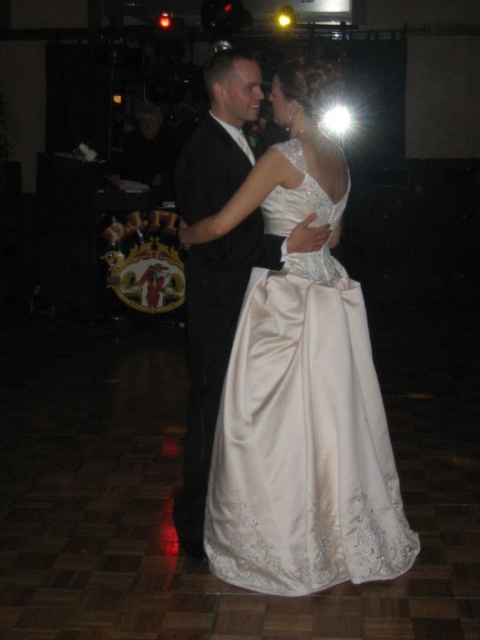
Question: Considering the relative positions of satin/embroidered dress at center and black satin suit at center in the image provided, where is satin/embroidered dress at center located with respect to black satin suit at center?

Choices:
 (A) right
 (B) left

Answer: (A)

Question: Which point appears farthest from the camera in this image?

Choices:
 (A) (252, 120)
 (B) (287, 438)

Answer: (A)

Question: Can you confirm if satin/embroidered dress at center is positioned to the left of black satin suit at center?

Choices:
 (A) yes
 (B) no

Answer: (B)

Question: Which point is closer to the camera taking this photo?

Choices:
 (A) (282, 579)
 (B) (227, 68)

Answer: (A)

Question: Is satin/embroidered dress at center below black satin suit at center?

Choices:
 (A) no
 (B) yes

Answer: (B)